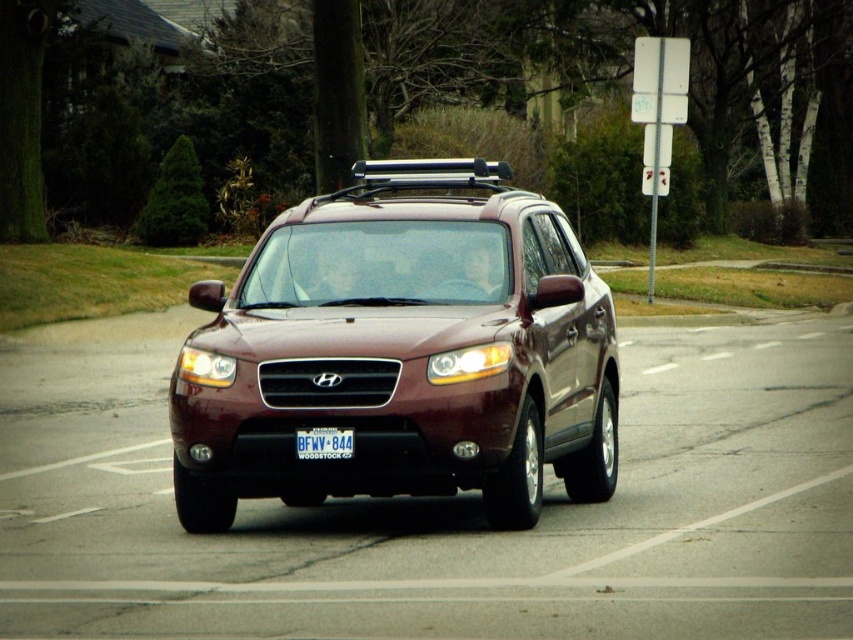
Question: Is satin burgundy suv at center above white plastic license plate at center?

Choices:
 (A) no
 (B) yes

Answer: (B)

Question: Can you confirm if satin burgundy suv at center is bigger than white plastic license plate at center?

Choices:
 (A) no
 (B) yes

Answer: (B)

Question: Is satin burgundy suv at center closer to the viewer compared to white plastic license plate at center?

Choices:
 (A) yes
 (B) no

Answer: (A)

Question: Which of the following is the farthest from the observer?

Choices:
 (A) (316, 440)
 (B) (483, 184)

Answer: (B)